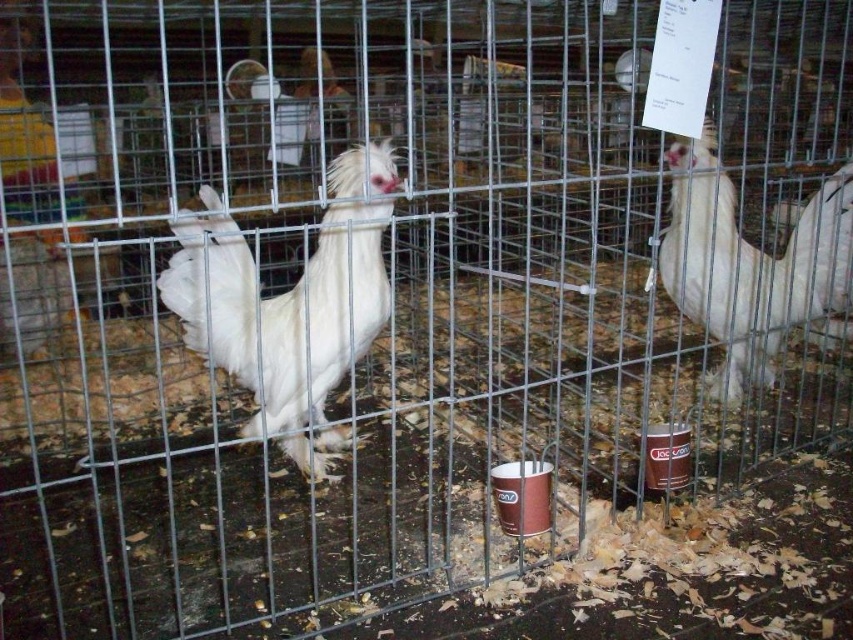
You are a photographer standing at a safe distance from the white feathered rooster at center. Your camera requires you to be at least 5 feet away to avoid disturbing the bird. Is your current position sufficient?

The white feathered rooster at center and camera are 4.81 feet apart, which is less than the required 5 feet. Therefore, the photographer needs to move back to ensure they are at least 5 feet away to avoid disturbing the bird.

You are a poultry judge at the exhibition and need to determine which bird is smaller. Based on the scene, which one is smaller between the white feathered rooster at center and the white fluffy chicken at right?

The white feathered rooster at center is smaller in size compared to the white fluffy chicken at right.